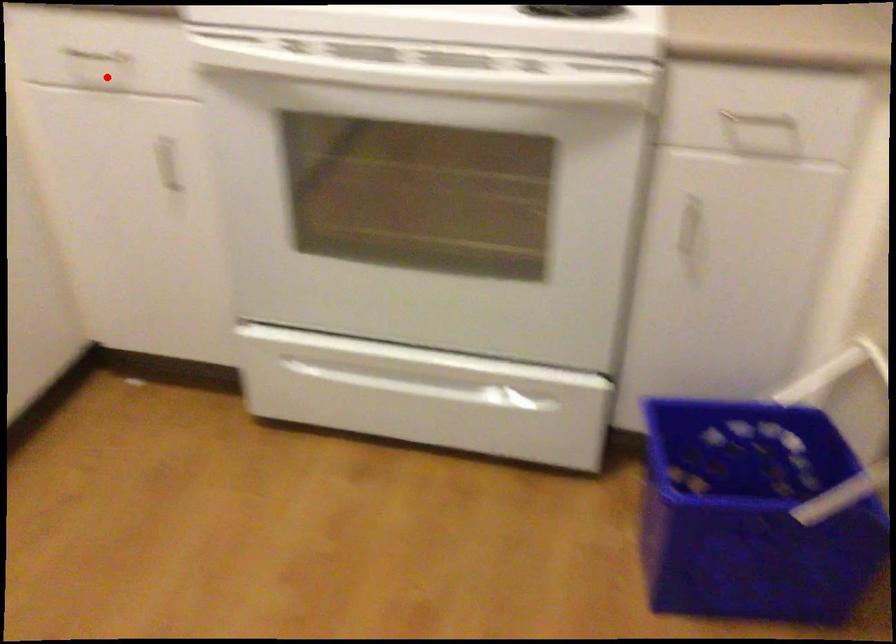
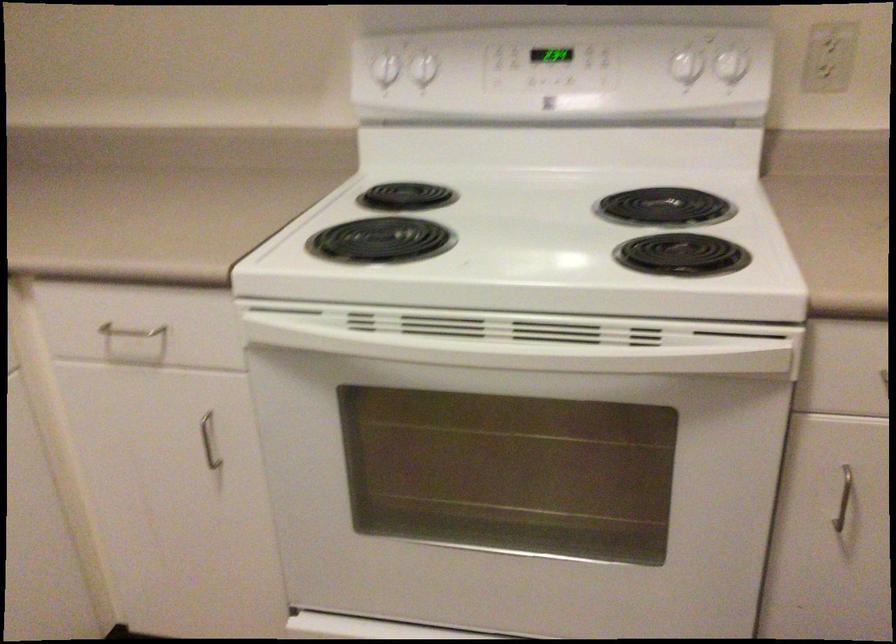
Find the pixel in the second image that matches the highlighted location in the first image.

(136, 337)